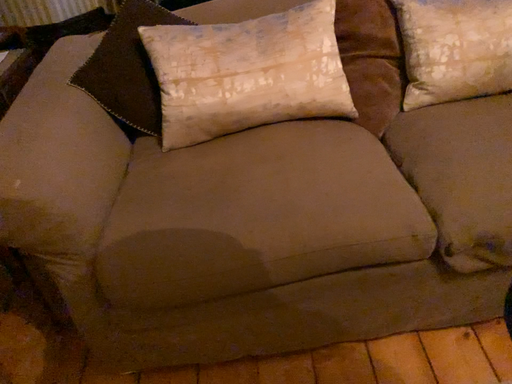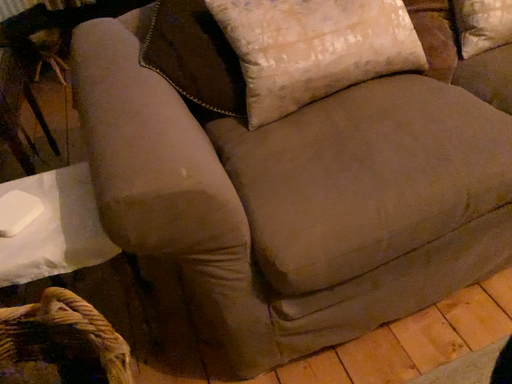
Question: How did the camera likely rotate when shooting the video?

Choices:
 (A) rotated left
 (B) rotated right

Answer: (B)